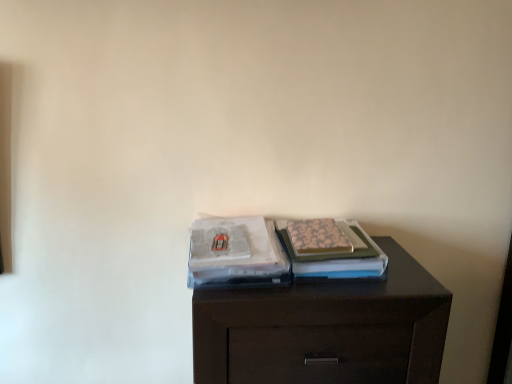
Question: Does matte plastic magazine at center, the 2th magazine from the right, lie in front of patterned paper magazine at center, which ranks as the 2th magazine in left-to-right order?

Choices:
 (A) yes
 (B) no

Answer: (A)

Question: Does matte plastic magazine at center, which is the first magazine from left to right, lie behind patterned paper magazine at center, which ranks as the 2th magazine in left-to-right order?

Choices:
 (A) yes
 (B) no

Answer: (B)

Question: Is matte plastic magazine at center, which is the first magazine from left to right, shorter than patterned paper magazine at center, which ranks as the 2th magazine in left-to-right order?

Choices:
 (A) no
 (B) yes

Answer: (B)

Question: From a real-world perspective, is matte plastic magazine at center, the 2th magazine from the right, beneath patterned paper magazine at center, which ranks as the 2th magazine in left-to-right order?

Choices:
 (A) no
 (B) yes

Answer: (B)

Question: Can you see matte plastic magazine at center, which is the first magazine from left to right, touching patterned paper magazine at center, which ranks as the 2th magazine in left-to-right order?

Choices:
 (A) no
 (B) yes

Answer: (A)

Question: From the image's perspective, does matte plastic magazine at center, which is the first magazine from left to right, appear lower than patterned paper magazine at center, which ranks as the 2th magazine in left-to-right order?

Choices:
 (A) no
 (B) yes

Answer: (B)

Question: Is dark wood chest of drawers at center aimed at matte plastic magazine at center, the 2th magazine from the right?

Choices:
 (A) yes
 (B) no

Answer: (B)

Question: Considering the relative sizes of dark wood chest of drawers at center and matte plastic magazine at center, which is the first magazine from left to right, in the image provided, is dark wood chest of drawers at center taller than matte plastic magazine at center, which is the first magazine from left to right,?

Choices:
 (A) yes
 (B) no

Answer: (A)

Question: From a real-world perspective, does dark wood chest of drawers at center stand above matte plastic magazine at center, which is the first magazine from left to right?

Choices:
 (A) no
 (B) yes

Answer: (A)

Question: Can you confirm if dark wood chest of drawers at center is wider than matte plastic magazine at center, the 2th magazine from the right?

Choices:
 (A) yes
 (B) no

Answer: (A)

Question: Is there a large distance between dark wood chest of drawers at center and matte plastic magazine at center, the 2th magazine from the right?

Choices:
 (A) yes
 (B) no

Answer: (B)

Question: Does dark wood chest of drawers at center have a lesser height compared to matte plastic magazine at center, which is the first magazine from left to right?

Choices:
 (A) yes
 (B) no

Answer: (B)

Question: Is patterned paper magazine at center, which ranks as the 2th magazine in left-to-right order, wider than matte plastic magazine at center, the 2th magazine from the right?

Choices:
 (A) yes
 (B) no

Answer: (B)